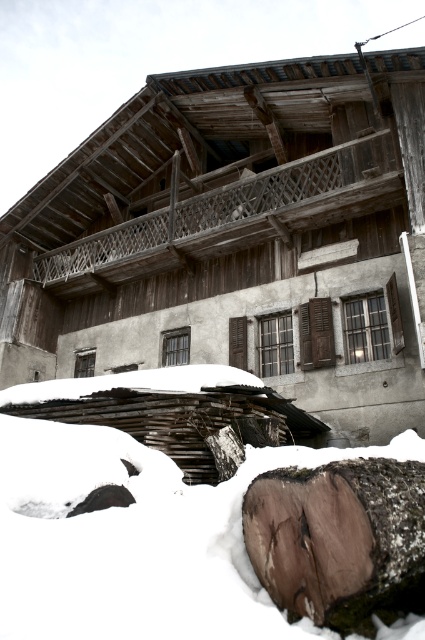
You are standing in front of the rustic wooden building and notice two points marked on its facade. The first point is at coordinate point (254, 132) and the second is at point (277, 596). Which point is closer to you?

Point (254, 132) is closer to you because it is further to the viewer than point (277, 596).

You are standing in front of the wooden log cabin at center and want to place a small decorative item on the brown rough wood at lower center. Considering their sizes, will the decorative item fit comfortably without overcrowding?

The wooden log cabin at center is larger than the brown rough wood at lower center. Since the brown rough wood at lower center is smaller, placing a small decorative item on it may fit but could still overcrowd it depending on the item size. Ensure the item is proportionate to the brown rough wood at lower center.